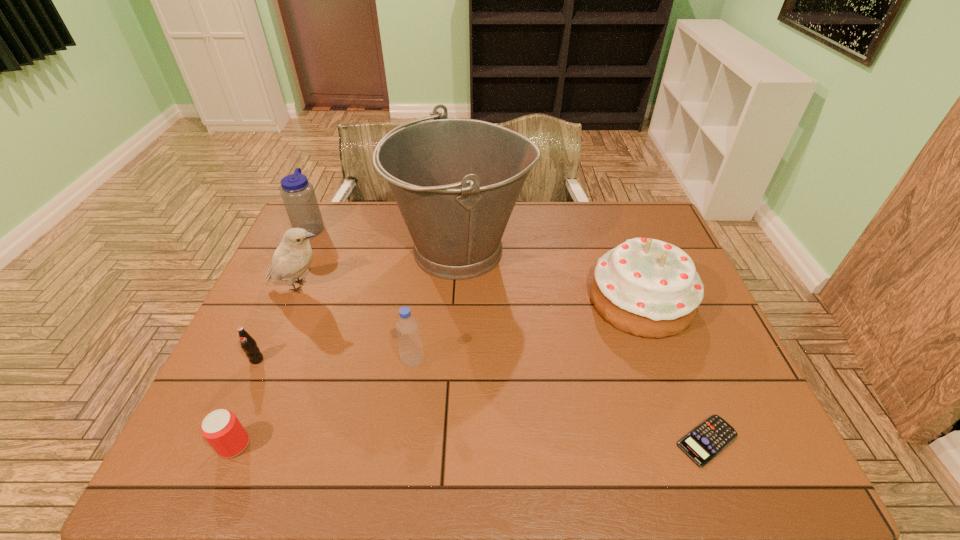
You are a GUI agent. You are given a task and a screenshot of the screen. Output one action in this format:
    pyautogui.click(x=<x>, y=<y>)
    Task: Click on the tallest object
    This screenshot has height=540, width=960.
    Given the screenshot: What is the action you would take?
    pyautogui.click(x=456, y=181)

Find the location of `bird`. bird is located at coordinates (293, 256).

The width and height of the screenshot is (960, 540). What are the coordinates of `water bottle` in the screenshot? It's located at (298, 195).

You are a GUI agent. You are given a task and a screenshot of the screen. Output one action in this format:
    pyautogui.click(x=<x>, y=<y>)
    Task: Click on the cake
    The image size is (960, 540).
    Given the screenshot: What is the action you would take?
    pyautogui.click(x=645, y=287)

Where is `bottle`? bottle is located at coordinates (410, 347).

Where is `pop`? The height and width of the screenshot is (540, 960). pop is located at coordinates (248, 344).

Where is `beer can`? This screenshot has height=540, width=960. beer can is located at coordinates (221, 428).

This screenshot has height=540, width=960. What are the coordinates of `the shortest object` in the screenshot? It's located at (703, 443).

You are a GUI agent. You are given a task and a screenshot of the screen. Output one action in this format:
    pyautogui.click(x=<x>, y=<y>)
    Task: Click on the vacant region located on the right of the bucket
    
    Given the screenshot: What is the action you would take?
    pyautogui.click(x=595, y=251)

Find the location of a particular element. free space located 0.150m at the beak of the bird is located at coordinates (381, 286).